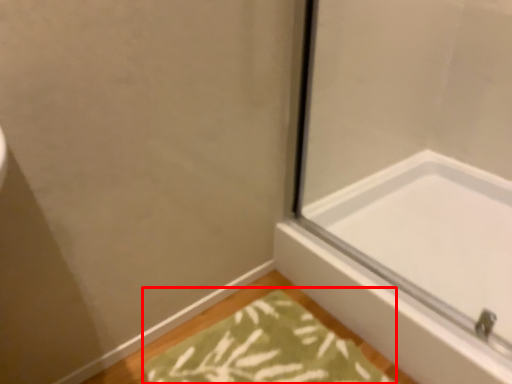
Question: Observing the image, what is the correct spatial positioning of bath mat (annotated by the red box) in reference to bathtub?

Choices:
 (A) left
 (B) right

Answer: (A)